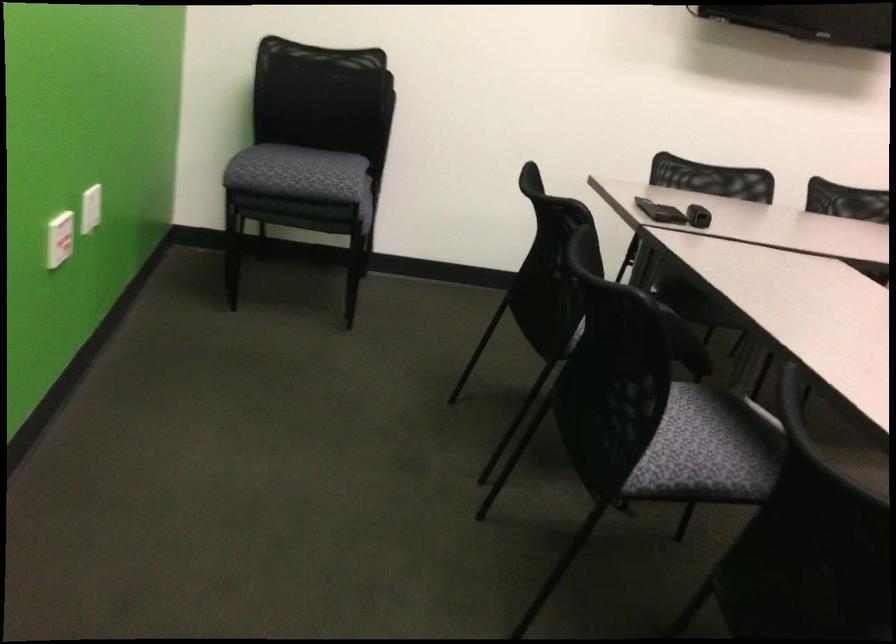
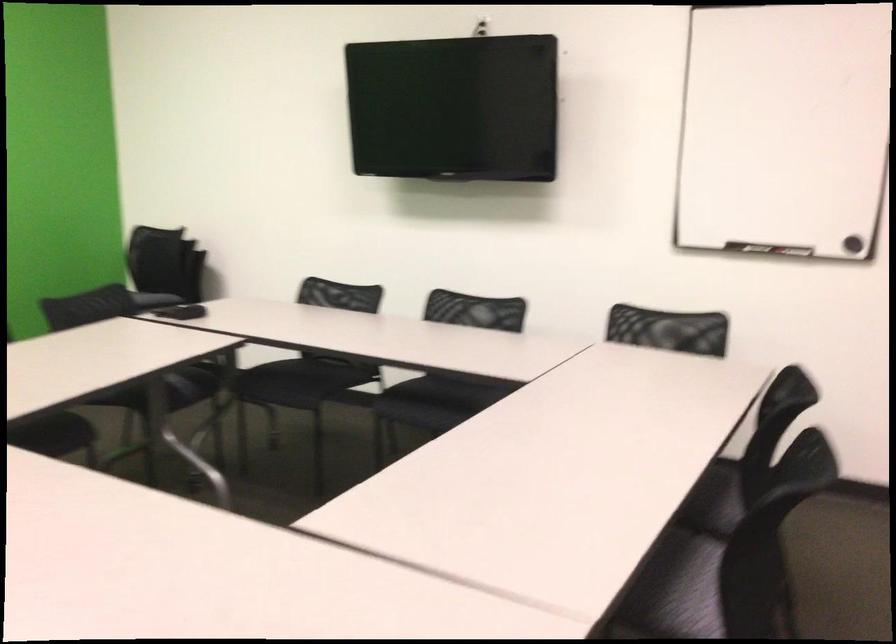
The point at (415, 175) is marked in the first image. Where is the corresponding point in the second image?

(181, 310)